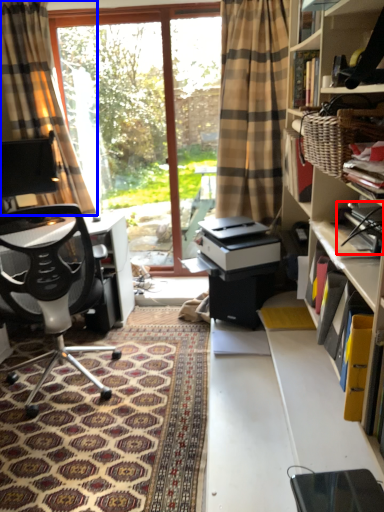
Question: Among these objects, which one is nearest to the camera, book (highlighted by a red box) or curtain (highlighted by a blue box)?

Choices:
 (A) book
 (B) curtain

Answer: (A)